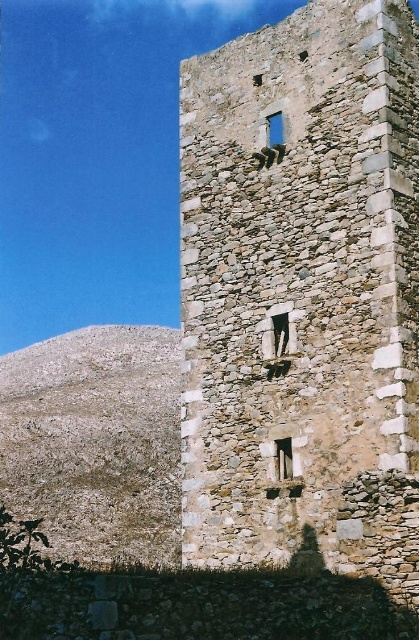
Which of these two, smooth stone window at center or blue glass window at center, stands taller?

smooth stone window at center is taller.

Does smooth stone window at center have a lesser height compared to blue glass window at center?

No.

Which is in front, point (266, 355) or point (271, 134)?

Point (266, 355) is in front.

At what (x,y) coordinates should I click in order to perform the action: click on smooth stone window at center. Please return your answer as a coordinate pair (x, y). Image resolution: width=419 pixels, height=640 pixels. Looking at the image, I should click on (279, 337).

Which is behind, point (416, 269) or point (282, 305)?

Positioned behind is point (282, 305).

What do you see at coordinates (304, 292) in the screenshot? I see `rustic stone tower at center` at bounding box center [304, 292].

Where is `rustic stone tower at center`? The height and width of the screenshot is (640, 419). rustic stone tower at center is located at coordinates coord(304,292).

Between point (264, 442) and point (276, 116), which one is positioned behind?

Point (276, 116)

The height and width of the screenshot is (640, 419). Describe the element at coordinates (304, 292) in the screenshot. I see `rustic stone tower at center` at that location.

The image size is (419, 640). Identify the location of rustic stone tower at center. (304, 292).